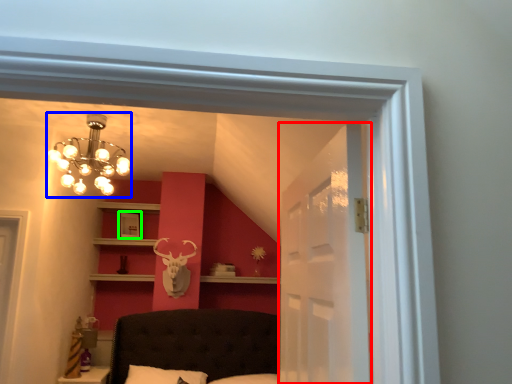
Question: Which object is positioned farthest from glass door (highlighted by a red box)? Select from lamp (highlighted by a blue box) and picture frame (highlighted by a green box).

Choices:
 (A) lamp
 (B) picture frame

Answer: (B)